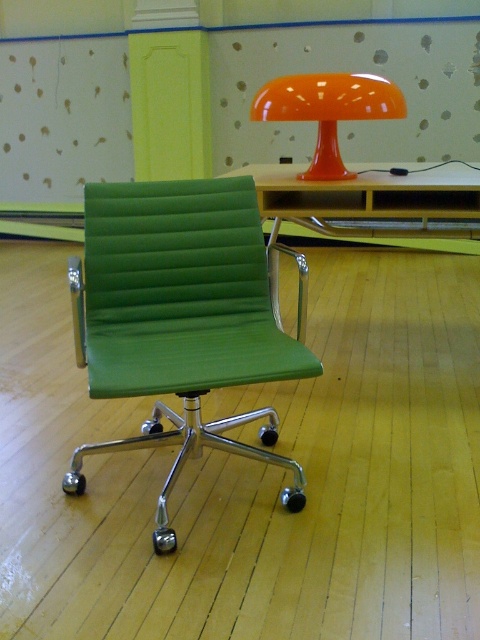
Does green leather chair at center have a smaller size compared to light wood table at center?

Correct, green leather chair at center occupies less space than light wood table at center.

Does point (146, 432) come closer to viewer compared to point (264, 204)?

Yes.

At what (x,y) coordinates should I click in order to perform the action: click on green leather chair at center. Please return your answer as a coordinate pair (x, y). This screenshot has height=640, width=480. Looking at the image, I should click on (180, 317).